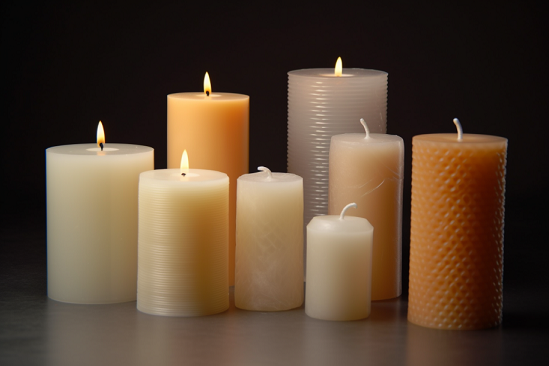
Find the location of `lit candles`. lit candles is located at coordinates (175, 217), (66, 206), (217, 125), (330, 103).